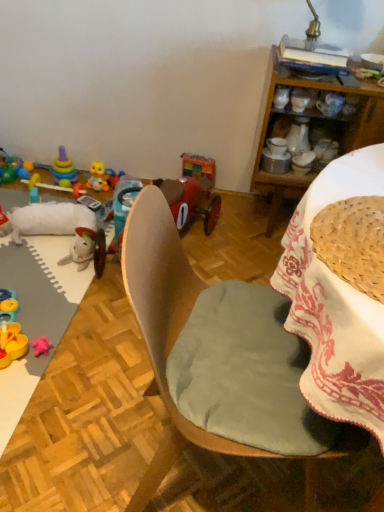
Question: From a real-world perspective, is wooden cabinet at upper right positioned above or below wooden chair at center?

Choices:
 (A) below
 (B) above

Answer: (A)

Question: Is wooden cabinet at upper right wider or thinner than wooden chair at center?

Choices:
 (A) thin
 (B) wide

Answer: (A)

Question: Considering the real-world distances, which object is closest to the wooden desk at center?

Choices:
 (A) wooden toy car at center, the first toy when ordered from right to left
 (B) woven straw basket at upper right
 (C) translucent plastic toy at left, the 5th toy viewed from the right
 (D) rubber duck at lower left, arranged as the third toy when viewed from the right
 (E) wooden cabinet at upper right

Answer: (B)

Question: Considering the real-world distances, which object is closest to the wooden cabinet at upper right?

Choices:
 (A) translucent plastic toy at left, which is counted as the 1th toy, starting from the left
 (B) wooden desk at center
 (C) stacked plastic rings at upper left, the second toy viewed from the left
 (D) wooden chair at center
 (E) woven straw basket at upper right

Answer: (B)